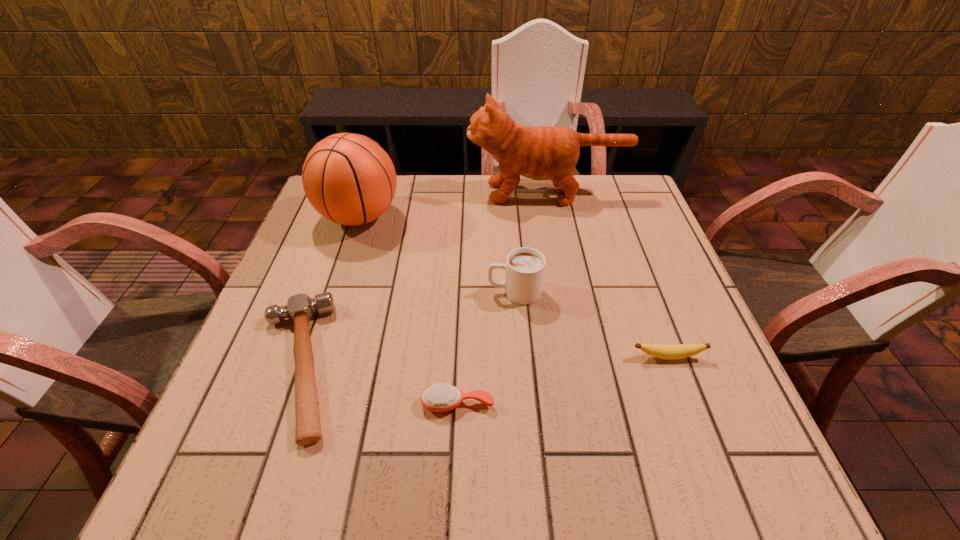
Identify the location of free space between the cappuccino and the hammer. (405, 328).

The image size is (960, 540). What are the coordinates of `free space that is in between the fourth shortest object and the banana` in the screenshot? It's located at (591, 324).

Identify the location of free area in between the tallest object and the basketball. (453, 205).

The width and height of the screenshot is (960, 540). Find the location of `blank region between the hairbrush and the banana`. blank region between the hairbrush and the banana is located at coordinates (563, 380).

I want to click on vacant space in between the cat and the third tallest object, so click(531, 242).

What are the coordinates of `free point between the hairbrush and the banana` in the screenshot? It's located at (563, 380).

You are a GUI agent. You are given a task and a screenshot of the screen. Output one action in this format:
    pyautogui.click(x=<x>, y=<y>)
    Task: Click on the free point between the hairbrush and the banana
    The height and width of the screenshot is (540, 960).
    Given the screenshot: What is the action you would take?
    pyautogui.click(x=563, y=380)

This screenshot has height=540, width=960. I want to click on free area in between the cat and the hairbrush, so click(502, 298).

This screenshot has width=960, height=540. What are the coordinates of `vacant region between the hairbrush and the hammer` in the screenshot? It's located at (377, 384).

I want to click on object that ranks as the closest to the hammer, so click(438, 398).